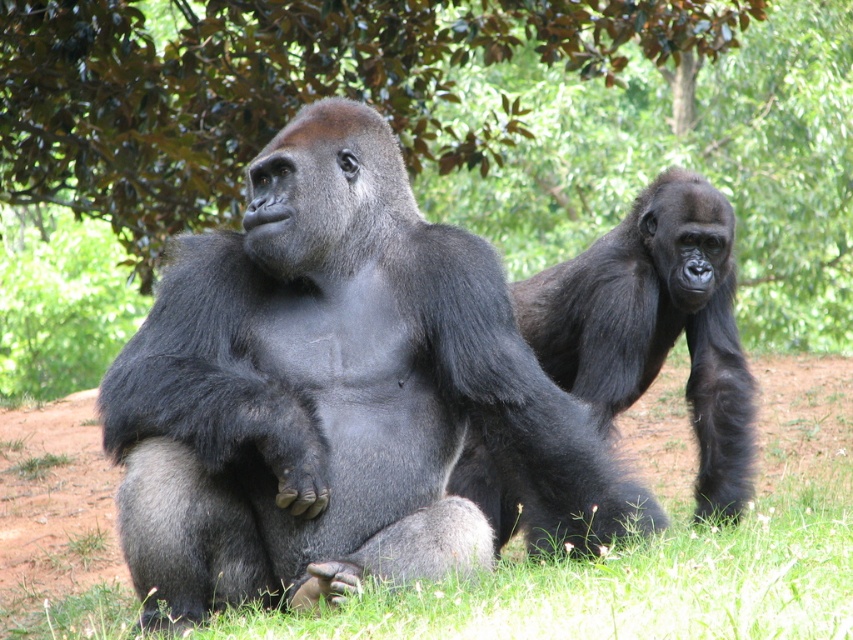
Question: Is green leafy tree at upper center below green soft grass at lower center?

Choices:
 (A) yes
 (B) no

Answer: (B)

Question: Estimate the real-world distances between objects in this image. Which object is farther from the black fuzzy gorilla at center?

Choices:
 (A) shiny dark fur gorilla at center
 (B) green soft grass at lower center

Answer: (A)

Question: Which of the following is the closest to the observer?

Choices:
 (A) shiny dark fur gorilla at center
 (B) black fuzzy gorilla at center

Answer: (A)

Question: Is shiny dark fur gorilla at center positioned at the back of green soft grass at lower center?

Choices:
 (A) yes
 (B) no

Answer: (A)

Question: Considering the relative positions of green leafy tree at upper center and green soft grass at lower center in the image provided, where is green leafy tree at upper center located with respect to green soft grass at lower center?

Choices:
 (A) right
 (B) left

Answer: (A)

Question: Which point appears farthest from the camera in this image?

Choices:
 (A) (804, 604)
 (B) (585, 305)
 (C) (477, 240)

Answer: (B)